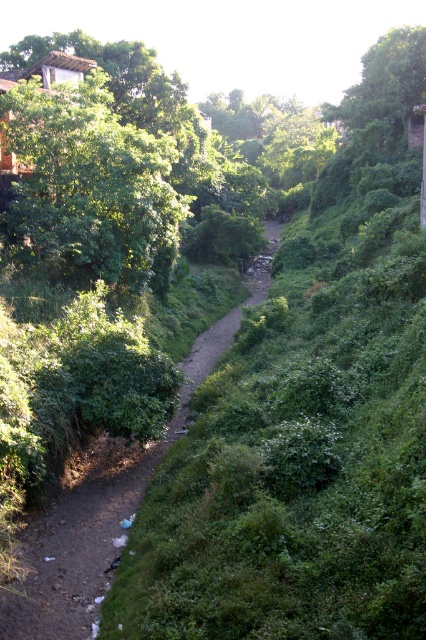
Question: Which object appears closest to the camera in this image?

Choices:
 (A) dirt path at center
 (B) green leafy tree at upper left
 (C) green leafy tree at upper right

Answer: (A)

Question: Can you confirm if green leafy tree at upper left is bigger than green leafy tree at upper right?

Choices:
 (A) no
 (B) yes

Answer: (A)

Question: Which object is positioned closest to the green leafy tree at upper left?

Choices:
 (A) green leafy tree at upper right
 (B) dirt path at center

Answer: (B)

Question: Is dirt path at center to the right of green leafy tree at upper right from the viewer's perspective?

Choices:
 (A) yes
 (B) no

Answer: (B)

Question: Is green leafy tree at upper left smaller than dirt path at center?

Choices:
 (A) yes
 (B) no

Answer: (B)

Question: Among these points, which one is farthest from the camera?

Choices:
 (A) (39, 243)
 (B) (154, 452)

Answer: (A)